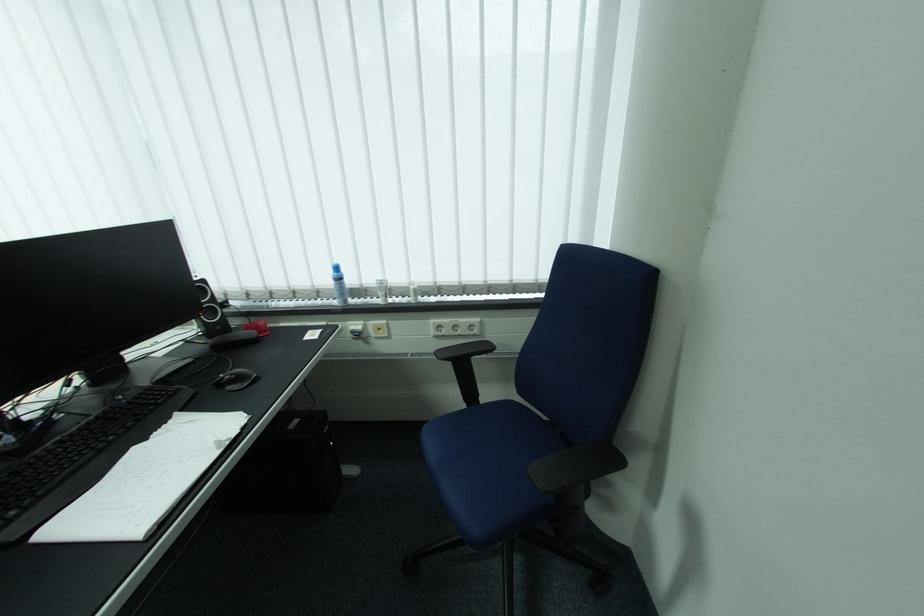
Where is `black computer mouse`? This screenshot has height=616, width=924. black computer mouse is located at coordinates (236, 379).